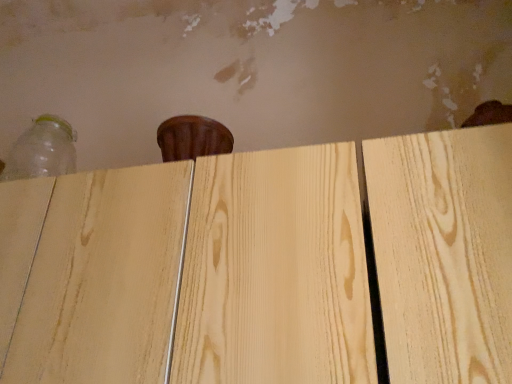
Find the location of a particular element. natural wood plywood at center is located at coordinates (275, 271).

This screenshot has width=512, height=384. Describe the element at coordinates (275, 271) in the screenshot. I see `natural wood plywood at center` at that location.

Where is `transparent plastic bottle at upper left`? The height and width of the screenshot is (384, 512). transparent plastic bottle at upper left is located at coordinates (42, 150).

What do you see at coordinates (42, 150) in the screenshot?
I see `transparent plastic bottle at upper left` at bounding box center [42, 150].

Identify the location of natural wood plywood at center. (275, 271).

Considering the relative positions of transparent plastic bottle at upper left and natural wood plywood at center in the image provided, is transparent plastic bottle at upper left to the left of natural wood plywood at center from the viewer's perspective?

Yes, transparent plastic bottle at upper left is to the left of natural wood plywood at center.

Does transparent plastic bottle at upper left come behind natural wood plywood at center?

Yes, it is.

Between point (48, 153) and point (308, 374), which one is positioned behind?

The point (48, 153) is behind.

Looking at this image, from the image's perspective, which one is positioned higher, transparent plastic bottle at upper left or natural wood plywood at center?

transparent plastic bottle at upper left, from the image's perspective.

From a real-world perspective, is transparent plastic bottle at upper left above or below natural wood plywood at center?

transparent plastic bottle at upper left is above natural wood plywood at center.

Is transparent plastic bottle at upper left thinner than natural wood plywood at center?

Yes, transparent plastic bottle at upper left is thinner than natural wood plywood at center.

From their relative heights in the image, would you say transparent plastic bottle at upper left is taller or shorter than natural wood plywood at center?

Considering their sizes, transparent plastic bottle at upper left has less height than natural wood plywood at center.

Does transparent plastic bottle at upper left have a smaller size compared to natural wood plywood at center?

Indeed, transparent plastic bottle at upper left has a smaller size compared to natural wood plywood at center.

Can we say transparent plastic bottle at upper left lies outside natural wood plywood at center?

Yes, transparent plastic bottle at upper left is not within natural wood plywood at center.

Consider the image. Is transparent plastic bottle at upper left far from natural wood plywood at center?

No.

Based on the photo, does transparent plastic bottle at upper left turn towards natural wood plywood at center?

No, transparent plastic bottle at upper left is not turned towards natural wood plywood at center.

What's the angular difference between transparent plastic bottle at upper left and natural wood plywood at center's facing directions?

The angle between the facing direction of transparent plastic bottle at upper left and the facing direction of natural wood plywood at center is 1.16 degrees.

The image size is (512, 384). Find the location of `plywood in front of the transparent plastic bottle at upper left`. plywood in front of the transparent plastic bottle at upper left is located at coordinates (275, 271).

Looking at this image, is natural wood plywood at center at the left side of transparent plastic bottle at upper left?

In fact, natural wood plywood at center is to the right of transparent plastic bottle at upper left.

Which is behind, natural wood plywood at center or transparent plastic bottle at upper left?

Positioned behind is transparent plastic bottle at upper left.

Is point (27, 205) less distant than point (72, 158)?

That is True.

In the scene shown: From the image's perspective, which one is positioned lower, natural wood plywood at center or transparent plastic bottle at upper left?

From the image's view, natural wood plywood at center is below.

From a real-world perspective, is natural wood plywood at center above or below transparent plastic bottle at upper left?

In terms of real-world spatial position, natural wood plywood at center is below transparent plastic bottle at upper left.

Between natural wood plywood at center and transparent plastic bottle at upper left, which one has smaller width?

transparent plastic bottle at upper left.

Is natural wood plywood at center shorter than transparent plastic bottle at upper left?

No, natural wood plywood at center is not shorter than transparent plastic bottle at upper left.

Who is bigger, natural wood plywood at center or transparent plastic bottle at upper left?

With larger size is natural wood plywood at center.

Can transparent plastic bottle at upper left be found inside natural wood plywood at center?

That's incorrect, transparent plastic bottle at upper left is not inside natural wood plywood at center.

Is natural wood plywood at center far away from transparent plastic bottle at upper left?

No.

Is natural wood plywood at center oriented away from transparent plastic bottle at upper left?

Answer: natural wood plywood at center is not turned away from transparent plastic bottle at upper left.

In the scene shown: How many degrees apart are the facing directions of natural wood plywood at center and transparent plastic bottle at upper left?

1.16 degrees separate the facing orientations of natural wood plywood at center and transparent plastic bottle at upper left.

Measure the distance from natural wood plywood at center to transparent plastic bottle at upper left.

The distance of natural wood plywood at center from transparent plastic bottle at upper left is 63.03 centimeters.

This screenshot has width=512, height=384. I want to click on plywood to the right of transparent plastic bottle at upper left, so click(275, 271).

Where is `plywood lying in front of the transparent plastic bottle at upper left`? plywood lying in front of the transparent plastic bottle at upper left is located at coordinates (275, 271).

Locate an element on the screen. The width and height of the screenshot is (512, 384). bottle that is above the natural wood plywood at center (from a real-world perspective) is located at coordinates (42, 150).